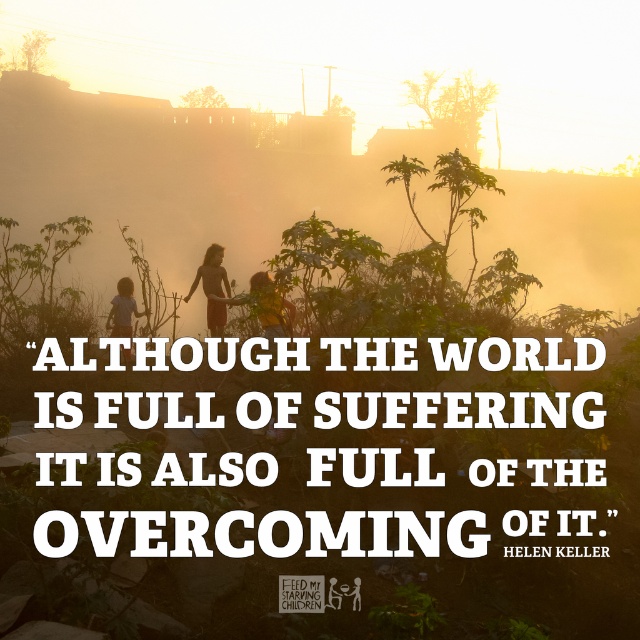
Is point (291, 307) more distant than point (212, 260)?

No.

Does yellow shirt at center appear over matte brown dress at center?

No, yellow shirt at center is not above matte brown dress at center.

You are a GUI agent. You are given a task and a screenshot of the screen. Output one action in this format:
    pyautogui.click(x=<x>, y=<y>)
    Task: Click on the yellow shirt at center
    The width and height of the screenshot is (640, 640).
    Given the screenshot: What is the action you would take?
    pyautogui.click(x=268, y=305)

Identify the location of yellow shirt at center. This screenshot has height=640, width=640. tap(268, 305).

Is point (284, 323) in front of point (120, 294)?

Yes, point (284, 323) is closer to viewer.

The width and height of the screenshot is (640, 640). Describe the element at coordinates (268, 305) in the screenshot. I see `yellow shirt at center` at that location.

I want to click on yellow shirt at center, so click(x=268, y=305).

Where is `yellow shirt at center`? yellow shirt at center is located at coordinates (268, 305).

How far apart are matte brown dress at center and light brown wooden stick at lower left?

They are 3.97 feet apart.

Can you confirm if matte brown dress at center is positioned below light brown wooden stick at lower left?

No, matte brown dress at center is not below light brown wooden stick at lower left.

Is point (216, 269) more distant than point (124, 323)?

That is True.

Where is `matte brown dress at center`? matte brown dress at center is located at coordinates tap(212, 289).